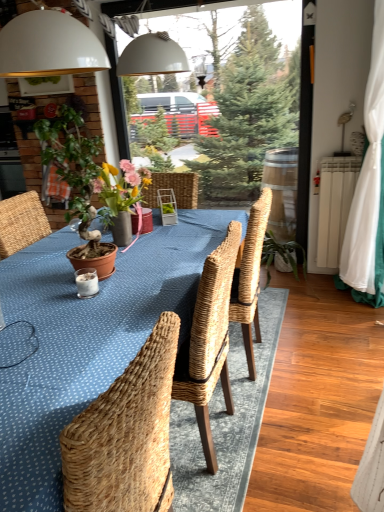
Identify the location of free space in front of terracotta pot at left. (73, 312).